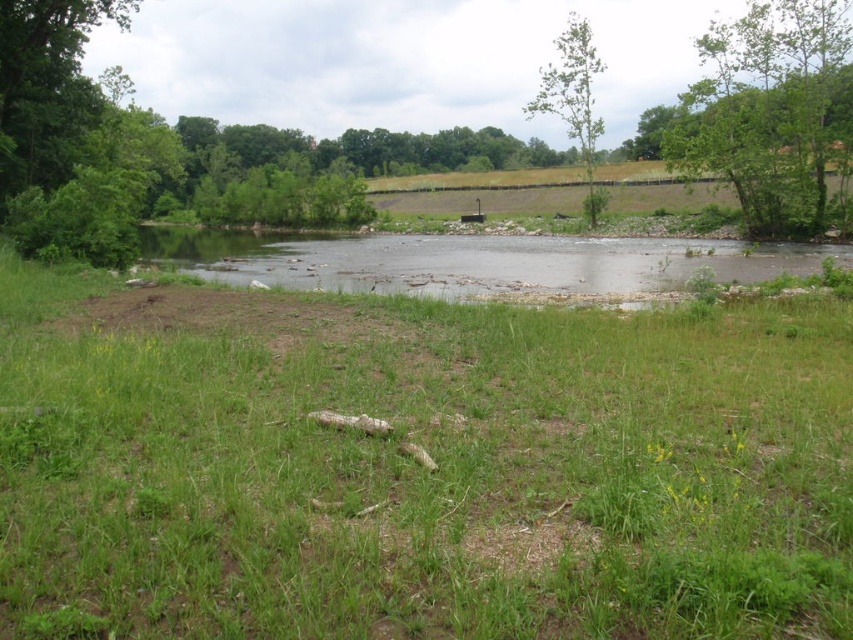
You are standing on the grassy area in the foreground of the image. You see the clear water at center and the green leafy tree at upper center. Which object is closer to you?

The clear water at center is closer to you because it is shorter than the green leafy tree at upper center, which is taller and located further away.

You are standing at the edge of the water and want to walk to the green leafy tree at upper right. Which direction should you walk to avoid stepping on the green grassy at center?

To reach the green leafy tree at upper right without stepping on the green grassy at center, you should walk around it towards the right or left side since the green grassy at center is in front of the tree, blocking the direct path.

You are standing at the edge of the pond and see two points marked in the scene. Which point is closer to you, point (265, 275) or point (587, 195)?

Point (265, 275) is closer to the viewer than point (587, 195).